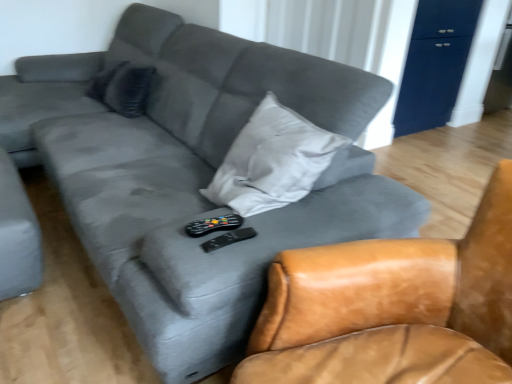
Question: Does black plastic remote at center, which is counted as the 2th remote, starting from the top, have a lesser height compared to matte dark blue dresser at upper right?

Choices:
 (A) yes
 (B) no

Answer: (A)

Question: Is black plastic remote at center, marked as the 1th remote in a bottom-to-top arrangement, directly adjacent to matte dark blue dresser at upper right?

Choices:
 (A) yes
 (B) no

Answer: (B)

Question: From the image's perspective, does black plastic remote at center, marked as the 1th remote in a bottom-to-top arrangement, appear higher than matte dark blue dresser at upper right?

Choices:
 (A) yes
 (B) no

Answer: (B)

Question: Does black plastic remote at center, which is counted as the 2th remote, starting from the top, have a larger size compared to matte dark blue dresser at upper right?

Choices:
 (A) no
 (B) yes

Answer: (A)

Question: Is black plastic remote at center, marked as the 1th remote in a bottom-to-top arrangement, inside the boundaries of black plastic remote at center, which appears as the first remote when viewed from the top, or outside?

Choices:
 (A) inside
 (B) outside

Answer: (B)

Question: Is black plastic remote at center, marked as the 1th remote in a bottom-to-top arrangement, wider or thinner than black plastic remote at center, acting as the second remote starting from the bottom?

Choices:
 (A) wide
 (B) thin

Answer: (B)

Question: In the image, is black plastic remote at center, marked as the 1th remote in a bottom-to-top arrangement, on the left side or the right side of black plastic remote at center, acting as the second remote starting from the bottom?

Choices:
 (A) right
 (B) left

Answer: (A)

Question: Relative to black plastic remote at center, which appears as the first remote when viewed from the top, is black plastic remote at center, which is counted as the 2th remote, starting from the top, in front or behind?

Choices:
 (A) behind
 (B) front

Answer: (B)

Question: Is black plastic remote at center, which appears as the first remote when viewed from the top, inside the boundaries of leather armchair at center, or outside?

Choices:
 (A) outside
 (B) inside

Answer: (A)

Question: From a real-world perspective, is black plastic remote at center, which appears as the first remote when viewed from the top, above or below leather armchair at center?

Choices:
 (A) below
 (B) above

Answer: (B)

Question: Would you say black plastic remote at center, acting as the second remote starting from the bottom, is to the left or to the right of leather armchair at center in the picture?

Choices:
 (A) left
 (B) right

Answer: (A)

Question: Relative to leather armchair at center, is black plastic remote at center, acting as the second remote starting from the bottom, in front or behind?

Choices:
 (A) behind
 (B) front

Answer: (A)

Question: Considering their positions, is matte dark blue dresser at upper right located in front of or behind dark gray fabric pillow at upper left?

Choices:
 (A) front
 (B) behind

Answer: (B)

Question: In terms of size, does matte dark blue dresser at upper right appear bigger or smaller than dark gray fabric pillow at upper left?

Choices:
 (A) small
 (B) big

Answer: (B)